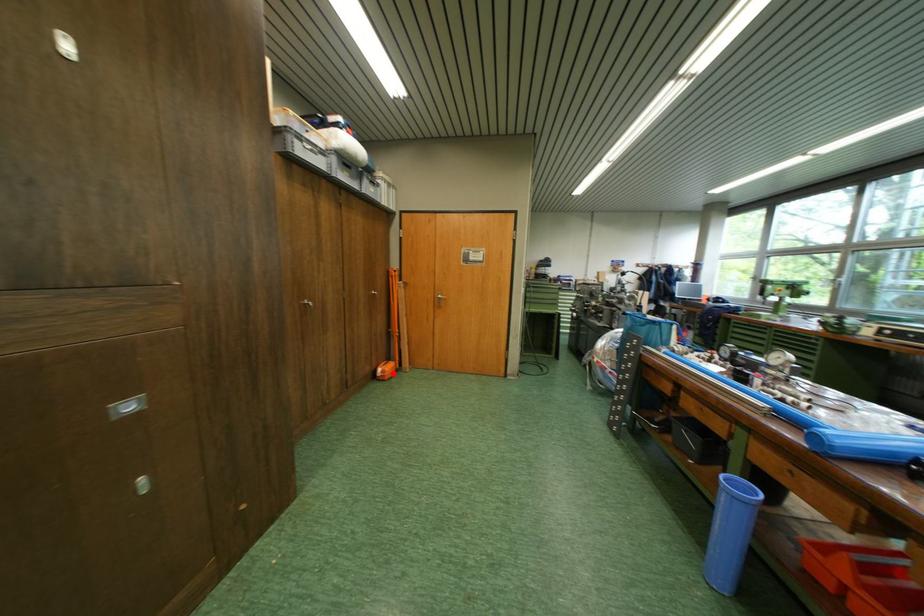
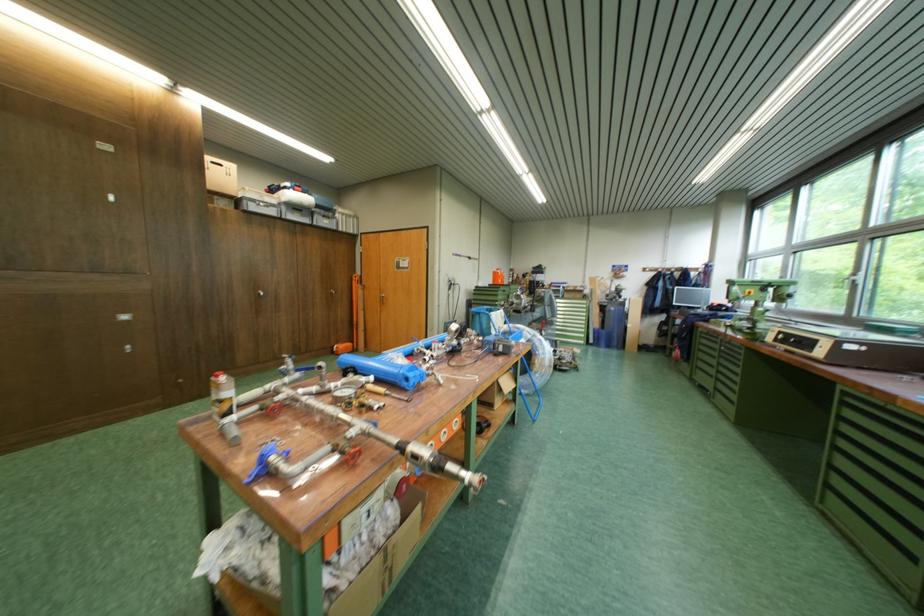
The point at the highlighted location is marked in the first image. Where is the corresponding point in the second image?

(347, 350)